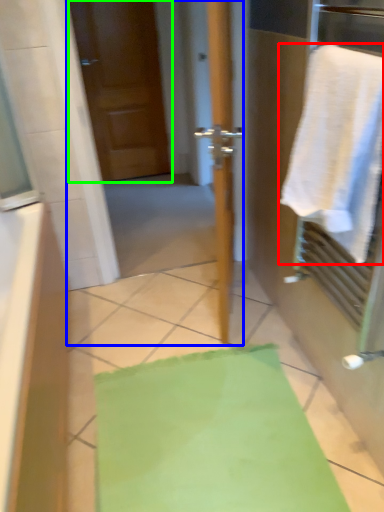
Question: Which object is positioned closest to towel (highlighted by a red box)? Select from screen door (highlighted by a blue box) and door (highlighted by a green box).

Choices:
 (A) screen door
 (B) door

Answer: (B)